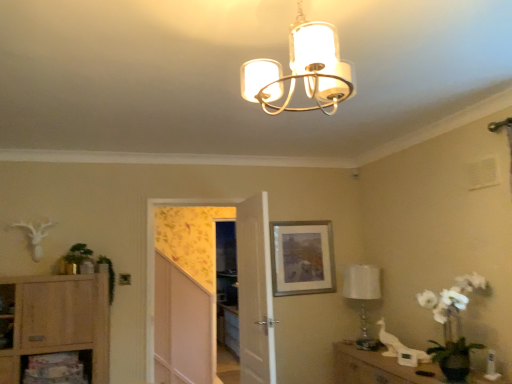
Question: Can you confirm if green leafy plant at left, which appears as the 1th plant when viewed from the left, is wider than green leafy plant at left, marked as the first plant in a right-to-left arrangement?

Choices:
 (A) no
 (B) yes

Answer: (B)

Question: Is green leafy plant at left, the second plant from the right, aimed at green leafy plant at left, the 2th plant in the left-to-right sequence?

Choices:
 (A) no
 (B) yes

Answer: (A)

Question: Is green leafy plant at left, the second plant from the right, at the right side of green leafy plant at left, marked as the first plant in a right-to-left arrangement?

Choices:
 (A) no
 (B) yes

Answer: (A)

Question: From a real-world perspective, is green leafy plant at left, which appears as the 1th plant when viewed from the left, under green leafy plant at left, marked as the first plant in a right-to-left arrangement?

Choices:
 (A) yes
 (B) no

Answer: (B)

Question: Does green leafy plant at left, which appears as the 1th plant when viewed from the left, have a larger size compared to green leafy plant at left, the 2th plant in the left-to-right sequence?

Choices:
 (A) yes
 (B) no

Answer: (A)

Question: Considering the relative positions of green leafy plant at left, which appears as the 1th plant when viewed from the left, and green leafy plant at left, the 2th plant in the left-to-right sequence, in the image provided, is green leafy plant at left, which appears as the 1th plant when viewed from the left, to the left of green leafy plant at left, the 2th plant in the left-to-right sequence, from the viewer's perspective?

Choices:
 (A) no
 (B) yes

Answer: (B)

Question: From a real-world perspective, is light wood cabinet at lower left positioned under wooden cabinet at lower right based on gravity?

Choices:
 (A) yes
 (B) no

Answer: (B)

Question: From the image's perspective, is light wood cabinet at lower left on wooden cabinet at lower right?

Choices:
 (A) yes
 (B) no

Answer: (A)

Question: Considering the relative positions of light wood cabinet at lower left and wooden cabinet at lower right in the image provided, is light wood cabinet at lower left to the left of wooden cabinet at lower right from the viewer's perspective?

Choices:
 (A) yes
 (B) no

Answer: (A)

Question: Does light wood cabinet at lower left have a greater width compared to wooden cabinet at lower right?

Choices:
 (A) yes
 (B) no

Answer: (B)

Question: Considering the relative sizes of light wood cabinet at lower left and wooden cabinet at lower right in the image provided, is light wood cabinet at lower left taller than wooden cabinet at lower right?

Choices:
 (A) no
 (B) yes

Answer: (B)

Question: Is light wood cabinet at lower left positioned far away from wooden cabinet at lower right?

Choices:
 (A) yes
 (B) no

Answer: (A)

Question: Considering the relative positions of light wood cabinet at lower left and green leafy plant at left, the second plant from the right, in the image provided, is light wood cabinet at lower left behind green leafy plant at left, the second plant from the right,?

Choices:
 (A) no
 (B) yes

Answer: (A)